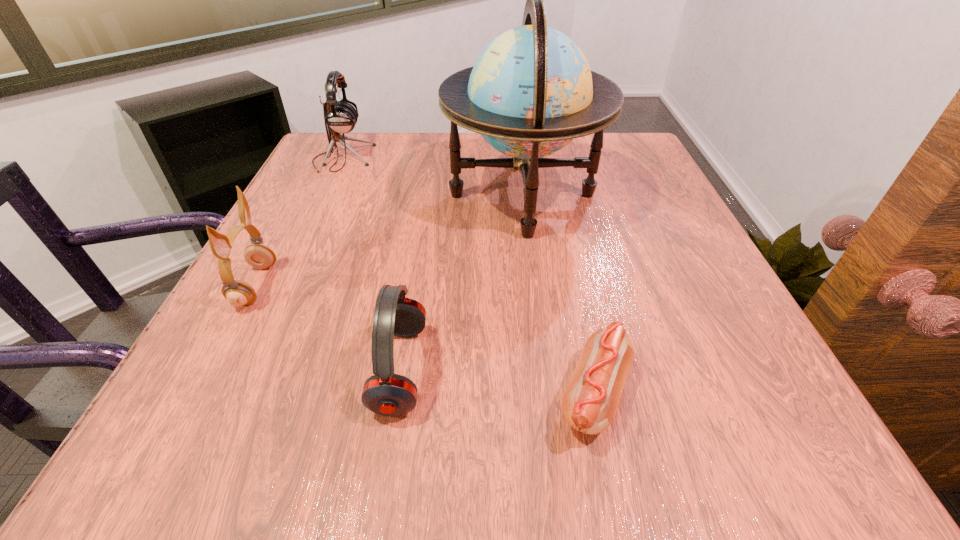
Locate an element on the screen. The width and height of the screenshot is (960, 540). vacant space located on the surface of the tallest object is located at coordinates (375, 195).

Find the location of `vacant area located on the front of the tallest earphone`. vacant area located on the front of the tallest earphone is located at coordinates (299, 253).

Where is `vacant region located on the front-facing side of the third nearest object`? vacant region located on the front-facing side of the third nearest object is located at coordinates point(499,285).

You are a GUI agent. You are given a task and a screenshot of the screen. Output one action in this format:
    pyautogui.click(x=<x>, y=<y>)
    Task: Click on the vacant point located on the ear cups of the third object from right to left
    This screenshot has width=960, height=540.
    Given the screenshot: What is the action you would take?
    pyautogui.click(x=677, y=369)

Locate an element on the screen. free space located on the right of the sausage is located at coordinates (782, 395).

In order to click on globe located in the far edge section of the desktop in this screenshot , I will do `click(531, 91)`.

Locate an element on the screen. This screenshot has width=960, height=540. earphone present at the far edge is located at coordinates (340, 116).

Locate an element on the screen. The image size is (960, 540). earphone at the near edge is located at coordinates (385, 393).

Identify the location of sausage that is at the near edge. (589, 404).

Where is `object positioned at the right edge`? The height and width of the screenshot is (540, 960). object positioned at the right edge is located at coordinates pos(531,91).